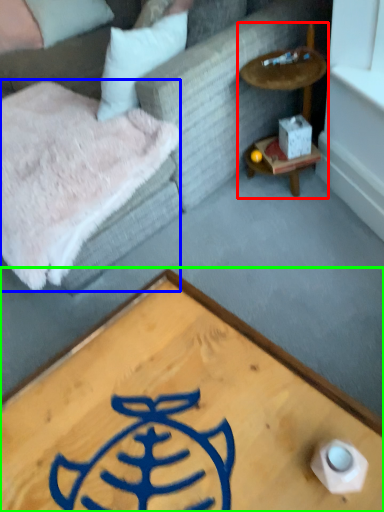
Question: Which object is the closest to the cocktail table (highlighted by a red box)? Choose among these: blanket (highlighted by a blue box) or coffee table (highlighted by a green box).

Choices:
 (A) blanket
 (B) coffee table

Answer: (A)